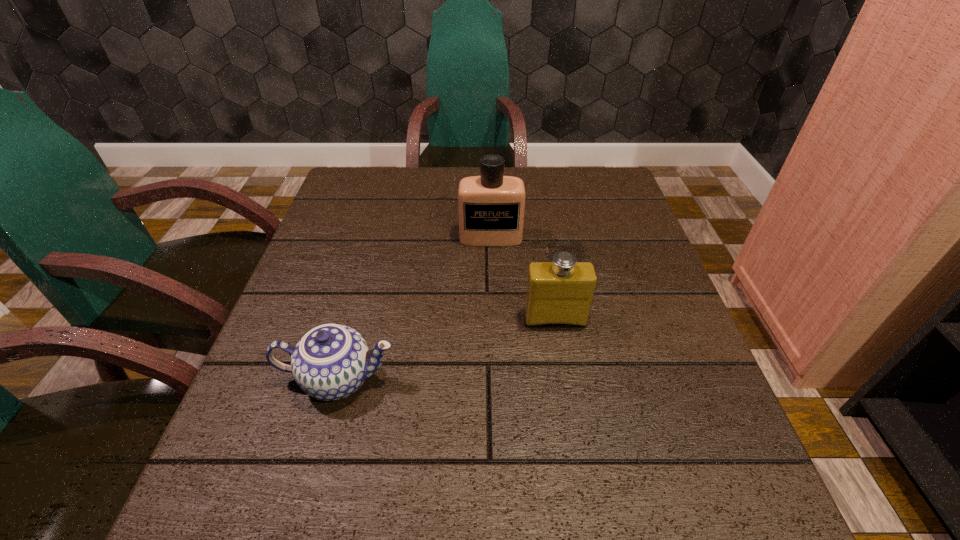
I want to click on free spot between the chinaware and the nearer perfume, so click(446, 349).

Locate an element on the screen. The image size is (960, 540). free space between the nearest object and the farthest object is located at coordinates (415, 308).

Identify the location of free space between the nearer perfume and the farthest object. The width and height of the screenshot is (960, 540). (523, 278).

Identify the location of unoccupied position between the chinaware and the second nearest object. This screenshot has width=960, height=540. (446, 349).

The width and height of the screenshot is (960, 540). Identify the location of the second closest object to the farthest object. [330, 362].

This screenshot has width=960, height=540. Find the location of `object that is the second closest to the chinaware`. object that is the second closest to the chinaware is located at coordinates (491, 207).

The image size is (960, 540). I want to click on free space that satisfies the following two spatial constraints: 1. on the front-facing side of the second farthest object; 2. at the spout of the chinaware, so click(x=564, y=379).

Identify the location of vacant area in the image that satisfies the following two spatial constraints: 1. on the front label of the farthest object; 2. at the spout of the chinaware. (494, 379).

Find the location of `vacant space that satisfies the following two spatial constraints: 1. on the front label of the farther perfume; 2. at the spout of the nearest object`. vacant space that satisfies the following two spatial constraints: 1. on the front label of the farther perfume; 2. at the spout of the nearest object is located at coordinates (494, 379).

Find the location of a particular element. The width and height of the screenshot is (960, 540). vacant space that satisfies the following two spatial constraints: 1. on the front-facing side of the second nearest object; 2. at the spout of the shortest object is located at coordinates (564, 379).